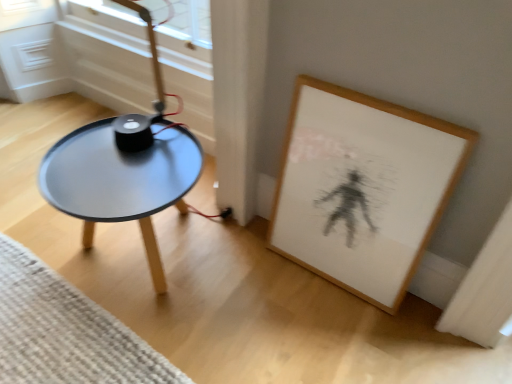
Locate an element on the screen. This screenshot has height=384, width=512. free space to the right of matte black table at left is located at coordinates (252, 290).